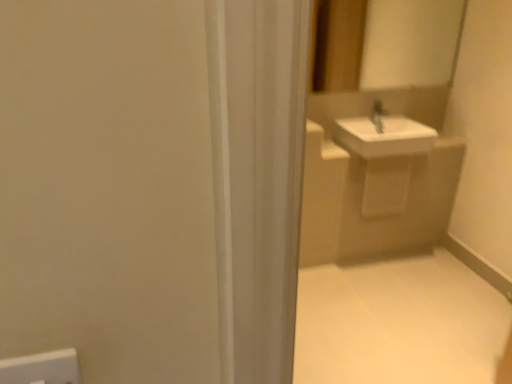
The height and width of the screenshot is (384, 512). Identify the location of white glossy sink at upper right. (383, 135).

Locate an element on the screen. The height and width of the screenshot is (384, 512). white glossy sink at upper right is located at coordinates (383, 135).

Is white glossy mirror at upper center wider than white tile floor at lower right?

In fact, white glossy mirror at upper center might be narrower than white tile floor at lower right.

From a real-world perspective, who is located higher, white glossy mirror at upper center or white tile floor at lower right?

white glossy mirror at upper center.

From the image's perspective, does white glossy mirror at upper center appear lower than white tile floor at lower right?

Incorrect, from the image's perspective, white glossy mirror at upper center is higher than white tile floor at lower right.

Is point (452, 65) closer or farther from the camera than point (421, 327)?

Point (452, 65) is farther from the camera than point (421, 327).

Which object is positioned more to the right, white glossy mirror at upper center or white glossy sink at upper right?

From the viewer's perspective, white glossy sink at upper right appears more on the right side.

Between white glossy mirror at upper center and white glossy sink at upper right, which one has smaller width?

With smaller width is white glossy mirror at upper center.

Is white glossy mirror at upper center closer to the viewer compared to white glossy sink at upper right?

Yes, white glossy mirror at upper center is in front of white glossy sink at upper right.

Does white tile floor at lower right turn towards white glossy sink at upper right?

No, white tile floor at lower right is not turned towards white glossy sink at upper right.

From the image's perspective, is white tile floor at lower right under white glossy sink at upper right?

Correct, white tile floor at lower right appears lower than white glossy sink at upper right in the image.

Is white tile floor at lower right positioned beyond the bounds of white glossy sink at upper right?

white tile floor at lower right is positioned outside white glossy sink at upper right.

In terms of height, does white tile floor at lower right look taller or shorter compared to white glossy sink at upper right?

In the image, white tile floor at lower right appears to be shorter than white glossy sink at upper right.

Is white tile floor at lower right facing away from white glossy mirror at upper center?

white tile floor at lower right is not turned away from white glossy mirror at upper center.

Is white tile floor at lower right in contact with white glossy mirror at upper center?

No, white tile floor at lower right is not beside white glossy mirror at upper center.

Considering the relative positions of white tile floor at lower right and white glossy mirror at upper center in the image provided, is white tile floor at lower right to the left of white glossy mirror at upper center from the viewer's perspective?

Yes, white tile floor at lower right is to the left of white glossy mirror at upper center.

How different are the orientations of white glossy sink at upper right and white glossy mirror at upper center in degrees?

There is a 0.533-degree angle between the facing directions of white glossy sink at upper right and white glossy mirror at upper center.

From the picture: Considering the sizes of objects white glossy sink at upper right and white glossy mirror at upper center in the image provided, who is wider, white glossy sink at upper right or white glossy mirror at upper center?

Wider between the two is white glossy sink at upper right.

From a real-world perspective, between white glossy sink at upper right and white glossy mirror at upper center, who is vertically lower?

white glossy sink at upper right is physically lower.

From the image's perspective, who appears lower, white glossy sink at upper right or white glossy mirror at upper center?

white glossy sink at upper right is shown below in the image.

Is point (402, 155) in front of point (392, 270)?

Yes, point (402, 155) is in front of point (392, 270).

From a real-world perspective, is white glossy sink at upper right physically located above or below white tile floor at lower right?

white glossy sink at upper right is above white tile floor at lower right.

Can you confirm if white glossy sink at upper right is bigger than white tile floor at lower right?

Indeed, white glossy sink at upper right has a larger size compared to white tile floor at lower right.

From the image's perspective, is white glossy sink at upper right on white tile floor at lower right?

Indeed, from the image's perspective, white glossy sink at upper right is shown above white tile floor at lower right.

This screenshot has width=512, height=384. What are the coordinates of `plain below the white glossy mirror at upper center (from a real-world perspective)` in the screenshot? It's located at (399, 323).

Where is `mirror that appears above the white glossy sink at upper right (from a real-world perspective)`? The height and width of the screenshot is (384, 512). mirror that appears above the white glossy sink at upper right (from a real-world perspective) is located at coordinates (384, 42).

Which object lies further to the anchor point white tile floor at lower right, white glossy sink at upper right or white glossy mirror at upper center?

white glossy mirror at upper center is positioned further to the anchor white tile floor at lower right.

Estimate the real-world distances between objects in this image. Which object is closer to white glossy mirror at upper center, white tile floor at lower right or white glossy sink at upper right?

white glossy sink at upper right is closer to white glossy mirror at upper center.

From the image, which object appears to be nearer to white glossy sink at upper right, white glossy mirror at upper center or white tile floor at lower right?

Among the two, white glossy mirror at upper center is located nearer to white glossy sink at upper right.

From the image, which object appears to be farther from white glossy mirror at upper center, white glossy sink at upper right or white tile floor at lower right?

The object further to white glossy mirror at upper center is white tile floor at lower right.

Looking at the image, which one is located closer to white tile floor at lower right, white glossy mirror at upper center or white glossy sink at upper right?

The object closer to white tile floor at lower right is white glossy sink at upper right.

Considering their positions, is white tile floor at lower right positioned closer to white glossy sink at upper right than white glossy mirror at upper center?

white glossy mirror at upper center.

The image size is (512, 384). I want to click on sink between white glossy mirror at upper center and white tile floor at lower right vertically, so click(383, 135).